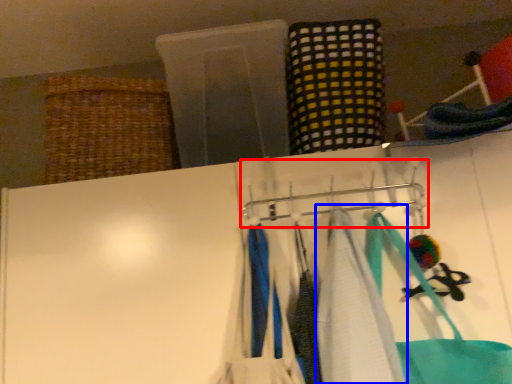
Question: Among these objects, which one is nearest to the camera, hanger (highlighted by a red box) or towel (highlighted by a blue box)?

Choices:
 (A) hanger
 (B) towel

Answer: (B)